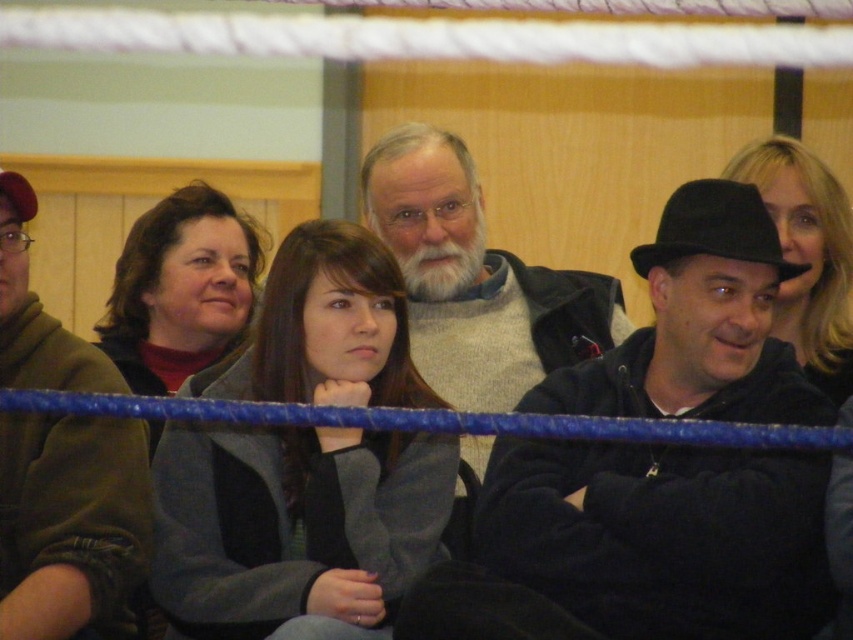
Does matte gray coat at center have a smaller size compared to blonde hair at center?

Actually, matte gray coat at center might be larger than blonde hair at center.

Is matte gray coat at center below blonde hair at center?

Correct, matte gray coat at center is located below blonde hair at center.

Between point (128, 358) and point (827, 269), which one is positioned in front?

Point (827, 269) is more forward.

At what (x,y) coordinates should I click in order to perform the action: click on matte gray coat at center. Please return your answer as a coordinate pair (x, y). Looking at the image, I should click on (180, 289).

Is black felt hat at right taller than rubber ring at center?

Correct, black felt hat at right is much taller as rubber ring at center.

Is black felt hat at right wider than rubber ring at center?

Indeed, black felt hat at right has a greater width compared to rubber ring at center.

The image size is (853, 640). What do you see at coordinates (660, 536) in the screenshot?
I see `black felt hat at right` at bounding box center [660, 536].

Find the location of a particular element. Image resolution: width=853 pixels, height=640 pixels. black felt hat at right is located at coordinates (660, 536).

Locate an element on the screen. gray wool sweater at center is located at coordinates (476, 280).

Does gray wool sweater at center appear on the right side of matte gray coat at center?

Yes, gray wool sweater at center is to the right of matte gray coat at center.

Which is in front, point (408, 284) or point (178, 372)?

Positioned in front is point (408, 284).

Where is `gray wool sweater at center`? This screenshot has width=853, height=640. gray wool sweater at center is located at coordinates (476, 280).